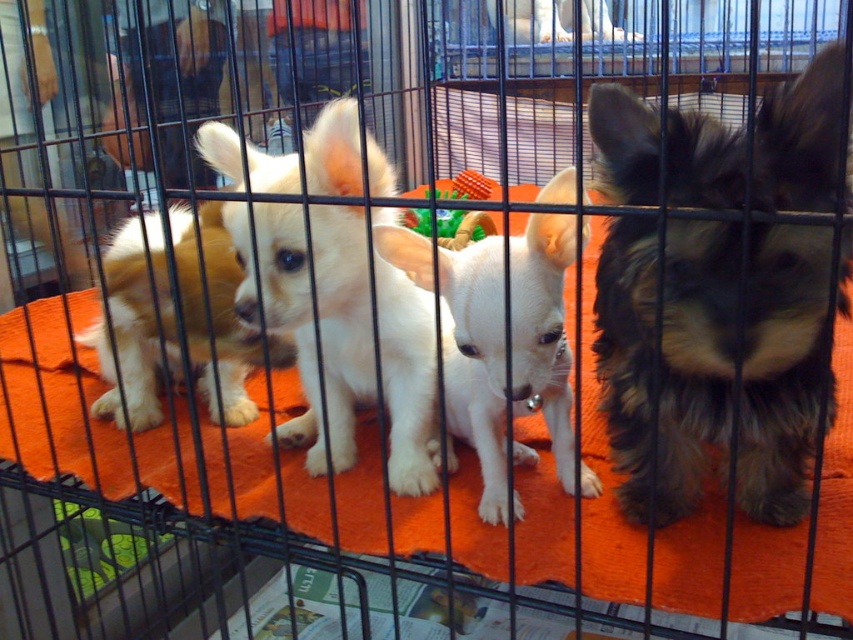
Can you confirm if dark brown fur at right is thinner than white fur at upper center?

Correct, dark brown fur at right's width is less than white fur at upper center's.

Who is more distant from viewer, (717, 280) or (492, 19)?

Positioned behind is point (492, 19).

Is point (633, 332) farther from viewer compared to point (601, 33)?

No, it is not.

Identify the location of dark brown fur at right. The height and width of the screenshot is (640, 853). (712, 358).

Consider the image. Can you confirm if white fur at center is bigger than white fur at upper center?

Indeed, white fur at center has a larger size compared to white fur at upper center.

Is white fur at center taller than white fur at upper center?

Indeed, white fur at center has a greater height compared to white fur at upper center.

Is point (572, 476) farther from viewer compared to point (555, 38)?

No, (572, 476) is in front of (555, 38).

Locate an element on the screen. The width and height of the screenshot is (853, 640). white fur at center is located at coordinates click(477, 362).

Does white fluffy dog at center appear under white fur at center?

Actually, white fluffy dog at center is above white fur at center.

Locate an element on the screen. white fluffy dog at center is located at coordinates (341, 321).